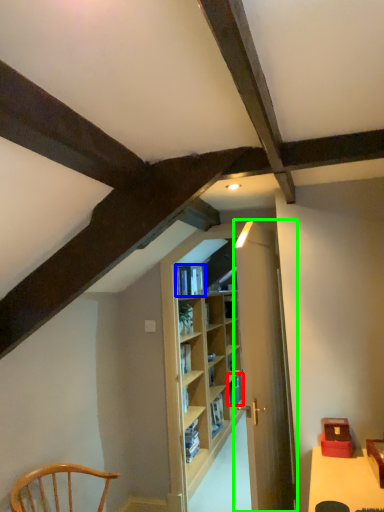
Question: Estimate the real-world distances between objects in this image. Which object is farther from book (highlighted by a red box), book (highlighted by a blue box) or door (highlighted by a green box)?

Choices:
 (A) book
 (B) door

Answer: (B)